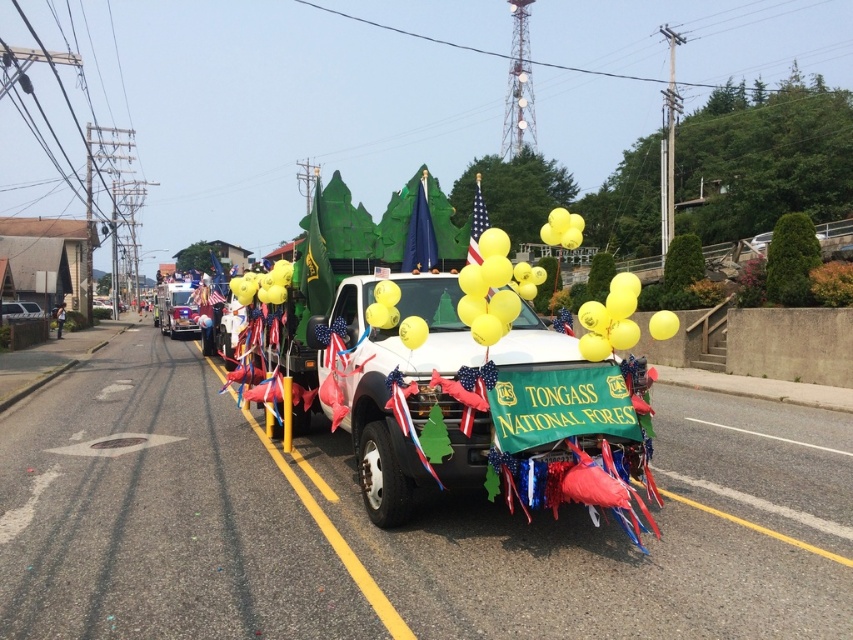
You are a photographer standing on the sidewalk and want to take a photo of both the shiny silver firetruck at center and the metallic silver car at left. Which one should you focus on first if you want to capture both in the same frame without moving your camera?

The shiny silver firetruck at center is located above the metallic silver car at left, so you should focus on the metallic silver car at left first to ensure both are in the frame without moving the camera.

You are a photographer positioned on the street during the parade. You want to capture both the shiny silver firetruck at center and the metallic silver car at left in a single shot. Which vehicle should you focus on first to ensure both are in frame?

You should focus on the shiny silver firetruck at center first because it is closer to you than the metallic silver car at left, so adjusting the camera to include the farther car would require a wider angle or moving back, ensuring both are in frame.

You are a photographer standing on the sidewalk. You want to take a photo of the white glossy pickup truck at center and the metallic silver car at left. Which vehicle will appear larger in your photo?

The white glossy pickup truck at center will appear larger in the photo because it is closer to the viewer than the metallic silver car at left.